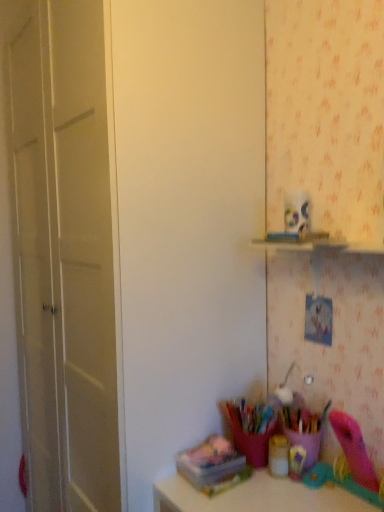
Question: In the image, is matte gold container at lower center, marked as the second stationery in a left-to-right arrangement, positioned in front of or behind translucent plastic container at lower center, the 3th stationery from the right?

Choices:
 (A) behind
 (B) front

Answer: (A)

Question: Is matte gold container at lower center, marked as the second stationery in a left-to-right arrangement, taller or shorter than translucent plastic container at lower center, marked as the first stationery in a left-to-right arrangement?

Choices:
 (A) short
 (B) tall

Answer: (B)

Question: Which object is positioned closest to the translucent plastic container at lower center, the 3th stationery from the right?

Choices:
 (A) matte white door at left
 (B) translucent plastic container at lower right, the third stationery from the left
 (C) matte gold container at lower center, marked as the second stationery in a left-to-right arrangement

Answer: (C)

Question: Estimate the real-world distances between objects in this image. Which object is farther from the translucent plastic container at lower right, which is the first stationery in right-to-left order?

Choices:
 (A) translucent plastic container at lower center, marked as the first stationery in a left-to-right arrangement
 (B) matte gold container at lower center, marked as the second stationery in a left-to-right arrangement
 (C) matte white door at left

Answer: (C)